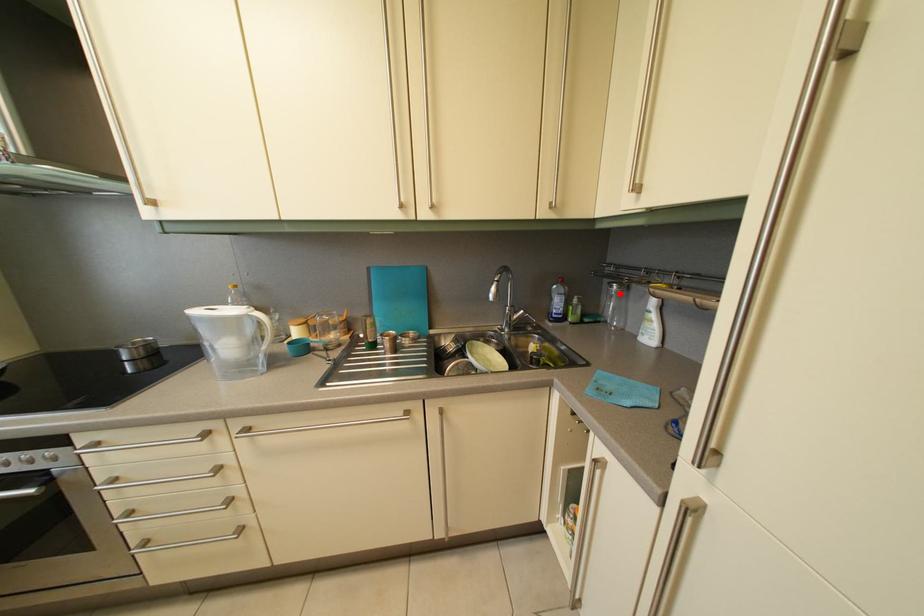
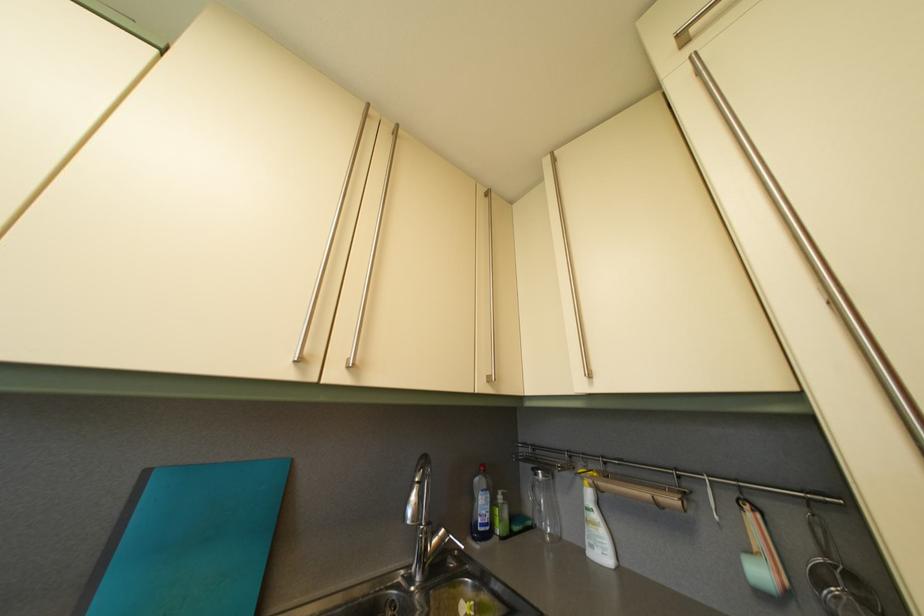
Question: I am providing you with two images of the same scene from different viewpoints. A red point is marked on the first image. Is the red point's position out of view in image 2?

Choices:
 (A) Yes
 (B) No

Answer: (B)